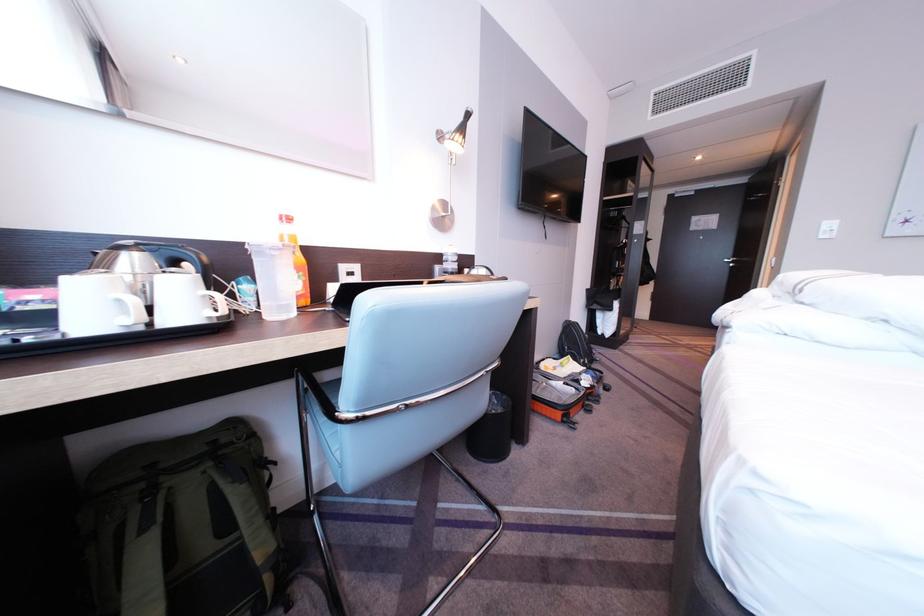
Where would you lift the kettle handle? Please return your answer as a coordinate pair (x, y).

(179, 256)